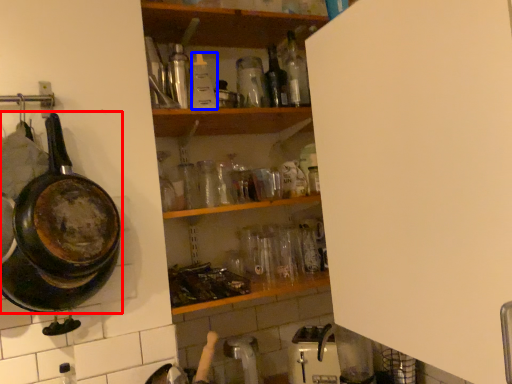
Question: Which object is further to the camera taking this photo, frying pan (highlighted by a red box) or bottle (highlighted by a blue box)?

Choices:
 (A) frying pan
 (B) bottle

Answer: (B)